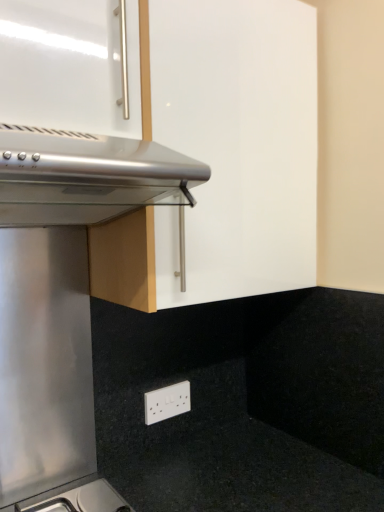
Measure the distance between white plastic electric outlet at lower center and camera.

white plastic electric outlet at lower center and camera are 3.92 feet apart.

What do you see at coordinates (81, 121) in the screenshot?
I see `satin silver oven at upper left` at bounding box center [81, 121].

This screenshot has height=512, width=384. Describe the element at coordinates (224, 157) in the screenshot. I see `matte white cabinet at upper center` at that location.

This screenshot has width=384, height=512. I want to click on white plastic electric outlet at lower center, so click(x=167, y=402).

Between satin silver oven at upper left and white plastic electric outlet at lower center, which one has larger width?

satin silver oven at upper left.

Is satin silver oven at upper left taller than white plastic electric outlet at lower center?

Yes, satin silver oven at upper left is taller than white plastic electric outlet at lower center.

Would you say satin silver oven at upper left is a long distance from white plastic electric outlet at lower center?

That's not correct — satin silver oven at upper left is a little close to white plastic electric outlet at lower center.

Is satin silver oven at upper left positioned with its back to white plastic electric outlet at lower center?

No.

Which of these two, matte white cabinet at upper center or white plastic electric outlet at lower center, stands shorter?

Standing shorter between the two is white plastic electric outlet at lower center.

Could you tell me if matte white cabinet at upper center is turned towards white plastic electric outlet at lower center?

No, matte white cabinet at upper center is not oriented towards white plastic electric outlet at lower center.

Consider the image. Between matte white cabinet at upper center and white plastic electric outlet at lower center, which one has smaller width?

white plastic electric outlet at lower center is thinner.

At what (x,y) coordinates should I click in order to perform the action: click on cabinetry above the white plastic electric outlet at lower center (from a real-world perspective). Please return your answer as a coordinate pair (x, y). This screenshot has height=512, width=384. Looking at the image, I should click on (224, 157).

Considering the sizes of white plastic electric outlet at lower center and satin silver oven at upper left in the image, is white plastic electric outlet at lower center bigger or smaller than satin silver oven at upper left?

In the image, white plastic electric outlet at lower center appears to be smaller than satin silver oven at upper left.

From a real-world perspective, is white plastic electric outlet at lower center below satin silver oven at upper left?

Yes, from a real-world perspective, white plastic electric outlet at lower center is beneath satin silver oven at upper left.

I want to click on oven that is above the white plastic electric outlet at lower center (from a real-world perspective), so click(x=81, y=121).

How different are the orientations of white plastic electric outlet at lower center and satin silver oven at upper left in degrees?

white plastic electric outlet at lower center and satin silver oven at upper left are facing 2.11 degrees away from each other.

Is point (296, 167) positioned behind point (40, 38)?

That is True.

Which of these two, matte white cabinet at upper center or satin silver oven at upper left, is bigger?

matte white cabinet at upper center.

From the image's perspective, relative to satin silver oven at upper left, is matte white cabinet at upper center above or below?

matte white cabinet at upper center is situated higher than satin silver oven at upper left in the image.

Is point (184, 386) closer or farther from the camera than point (245, 84)?

Clearly, point (184, 386) is more distant from the camera than point (245, 84).

From the image's perspective, which one is positioned higher, white plastic electric outlet at lower center or matte white cabinet at upper center?

matte white cabinet at upper center appears higher in the image.

This screenshot has width=384, height=512. Find the location of `electric outlet behind the matte white cabinet at upper center`. electric outlet behind the matte white cabinet at upper center is located at coordinates (167, 402).

Consider the image. Is white plastic electric outlet at lower center oriented away from matte white cabinet at upper center?

No, white plastic electric outlet at lower center's orientation is not away from matte white cabinet at upper center.

Is satin silver oven at upper left turned away from matte white cabinet at upper center?

That's right, satin silver oven at upper left is facing away from matte white cabinet at upper center.

Looking at this image, can we say satin silver oven at upper left lies outside matte white cabinet at upper center?

No, satin silver oven at upper left is not entirely external to matte white cabinet at upper center.

What's the angular difference between satin silver oven at upper left and matte white cabinet at upper center's facing directions?

0.783 degrees.

Is point (13, 97) more distant than point (228, 42)?

That is False.

You are a GUI agent. You are given a task and a screenshot of the screen. Output one action in this format:
    pyautogui.click(x=<x>, y=<y>)
    Task: Click on the electric outlet that is on the right side of satin silver oven at upper left
    The height and width of the screenshot is (512, 384).
    Given the screenshot: What is the action you would take?
    pyautogui.click(x=167, y=402)

Identify the location of electric outlet behind the matte white cabinet at upper center. This screenshot has width=384, height=512. (167, 402).

Considering their positions, is white plastic electric outlet at lower center positioned further to satin silver oven at upper left than matte white cabinet at upper center?

white plastic electric outlet at lower center.

Looking at the image, which one is located closer to white plastic electric outlet at lower center, satin silver oven at upper left or matte white cabinet at upper center?

matte white cabinet at upper center.

Which object lies nearer to the anchor point matte white cabinet at upper center, satin silver oven at upper left or white plastic electric outlet at lower center?

satin silver oven at upper left is positioned closer to the anchor matte white cabinet at upper center.

Based on their spatial positions, is matte white cabinet at upper center or satin silver oven at upper left further from white plastic electric outlet at lower center?

Based on the image, satin silver oven at upper left appears to be further to white plastic electric outlet at lower center.

From the image, which object appears to be nearer to satin silver oven at upper left, matte white cabinet at upper center or white plastic electric outlet at lower center?

matte white cabinet at upper center is positioned closer to the anchor satin silver oven at upper left.

Considering their positions, is white plastic electric outlet at lower center positioned further to matte white cabinet at upper center than satin silver oven at upper left?

Based on the image, white plastic electric outlet at lower center appears to be further to matte white cabinet at upper center.

At what (x,y) coordinates should I click in order to perform the action: click on cabinetry between satin silver oven at upper left and white plastic electric outlet at lower center in the front-back direction. Please return your answer as a coordinate pair (x, y). The height and width of the screenshot is (512, 384). Looking at the image, I should click on (224, 157).